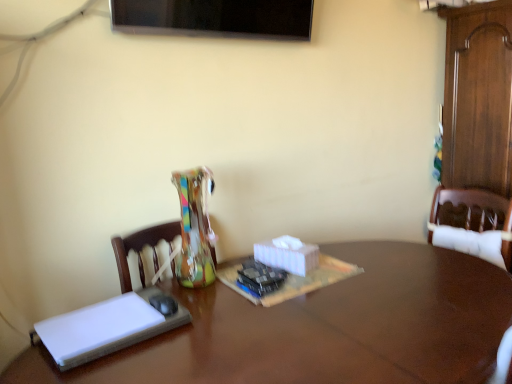
Question: Does brown wooden table at center have a larger size compared to white matte book at left?

Choices:
 (A) no
 (B) yes

Answer: (B)

Question: From a real-world perspective, is brown wooden table at center over white matte book at left?

Choices:
 (A) no
 (B) yes

Answer: (A)

Question: Is brown wooden table at center at the right side of white matte book at left?

Choices:
 (A) no
 (B) yes

Answer: (B)

Question: Does brown wooden table at center appear on the left side of white matte book at left?

Choices:
 (A) no
 (B) yes

Answer: (A)

Question: From a real-world perspective, is brown wooden table at center positioned under white matte book at left based on gravity?

Choices:
 (A) yes
 (B) no

Answer: (A)

Question: Does brown wooden table at center have a greater height compared to white matte book at left?

Choices:
 (A) yes
 (B) no

Answer: (A)

Question: From a real-world perspective, is white matte book at left beneath brown wooden table at center?

Choices:
 (A) no
 (B) yes

Answer: (A)

Question: Is the position of white matte book at left more distant than that of brown wooden table at center?

Choices:
 (A) yes
 (B) no

Answer: (A)

Question: From a real-world perspective, is white matte book at left on top of brown wooden table at center?

Choices:
 (A) yes
 (B) no

Answer: (A)

Question: From the image's perspective, is white matte book at left above brown wooden table at center?

Choices:
 (A) yes
 (B) no

Answer: (A)

Question: Would you consider white matte book at left to be distant from brown wooden table at center?

Choices:
 (A) yes
 (B) no

Answer: (B)

Question: Is white matte book at left taller than brown wooden table at center?

Choices:
 (A) yes
 (B) no

Answer: (B)

Question: Considering the positions of point (82, 349) and point (396, 347), is point (82, 349) closer or farther from the camera than point (396, 347)?

Choices:
 (A) farther
 (B) closer

Answer: (B)